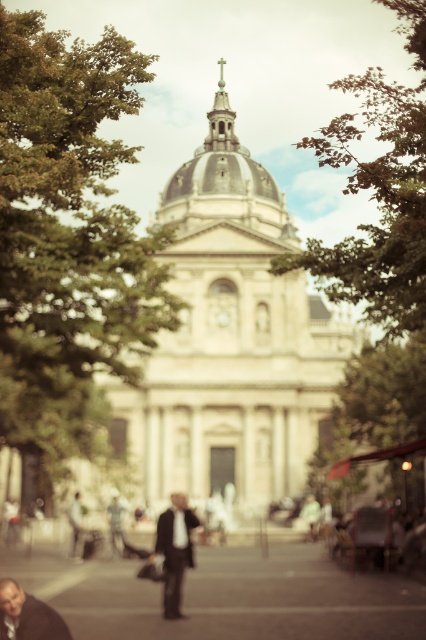
Is green leafy tree at left to the right of white stone church at center from the viewer's perspective?

In fact, green leafy tree at left is to the left of white stone church at center.

Between point (43, 333) and point (207, 483), which one is positioned behind?

The point (207, 483) is behind.

Find the location of a particular element. green leafy tree at left is located at coordinates (68, 243).

Is green leafy tree at left in front of matte brown jacket at lower left?

That is False.

Does point (8, 385) come closer to viewer compared to point (45, 618)?

That is False.

Where is `green leafy tree at left`? The height and width of the screenshot is (640, 426). green leafy tree at left is located at coordinates (68, 243).

Between green leafy tree at left and green leafy tree at upper center, which one is positioned higher?

Positioned higher is green leafy tree at left.

Who is positioned more to the right, green leafy tree at left or green leafy tree at upper center?

Positioned to the right is green leafy tree at upper center.

Find the location of a particular element. Image resolution: width=426 pixels, height=640 pixels. green leafy tree at left is located at coordinates (68, 243).

Identify the location of green leafy tree at left. The height and width of the screenshot is (640, 426). (68, 243).